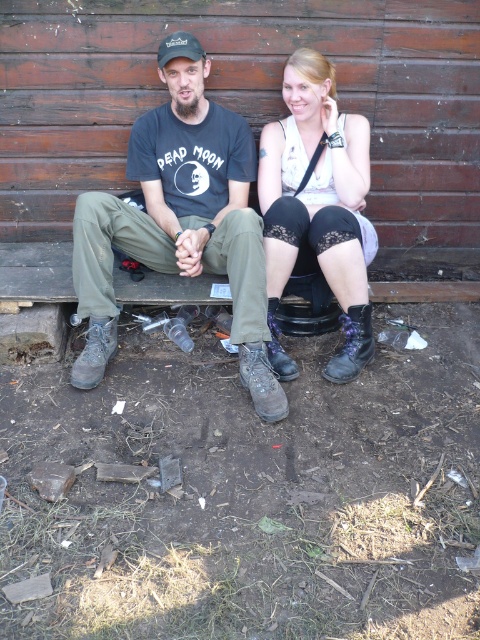
Between matte black t-shirt at center and matte white tank top at center, which one appears on the right side from the viewer's perspective?

Positioned to the right is matte white tank top at center.

Does point (98, 369) lie behind point (328, 170)?

No, (98, 369) is in front of (328, 170).

You are a GUI agent. You are given a task and a screenshot of the screen. Output one action in this format:
    pyautogui.click(x=<x>, y=<y>)
    Task: Click on the matte black t-shirt at center
    This screenshot has width=480, height=640.
    Given the screenshot: What is the action you would take?
    pyautogui.click(x=180, y=221)